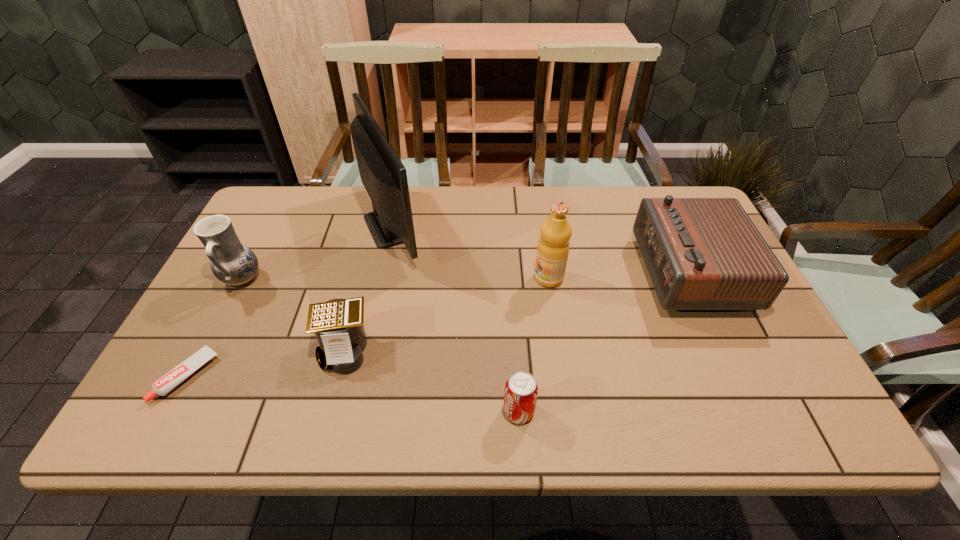
At what (x,y) coordinates should I click in order to perform the action: click on vacant space located on the front label of the sixth object from left to right. Please return your answer as a coordinate pair (x, y). Looking at the image, I should click on (508, 278).

Locate an element on the screen. The image size is (960, 540). vacant space located 0.380m on the front label of the sixth object from left to right is located at coordinates (395, 278).

You are a GUI agent. You are given a task and a screenshot of the screen. Output one action in this format:
    pyautogui.click(x=<x>, y=<y>)
    Task: Click on the vacant space located 0.350m on the right of the pottery
    
    Given the screenshot: What is the action you would take?
    [x=391, y=279]

At what (x,y) coordinates should I click in order to perform the action: click on vacant space positioned on the front panel of the radio receiver. Please return your answer as a coordinate pair (x, y). Looking at the image, I should click on (620, 272).

Identify the location of vacant area situated on the front panel of the radio receiver. (594, 272).

Where is `vacant space located on the front panel of the radio receiver`? vacant space located on the front panel of the radio receiver is located at coordinates (591, 272).

Image resolution: width=960 pixels, height=540 pixels. Find the location of `vacant space situated 0.070m on the left of the calculator`. vacant space situated 0.070m on the left of the calculator is located at coordinates (287, 349).

Locate an element on the screen. The width and height of the screenshot is (960, 540). vacant area located on the left of the fifth object from left to right is located at coordinates (324, 411).

The height and width of the screenshot is (540, 960). I want to click on free spot located on the back of the shortest object, so click(254, 249).

The image size is (960, 540). I want to click on computer monitor at the far edge, so click(x=382, y=173).